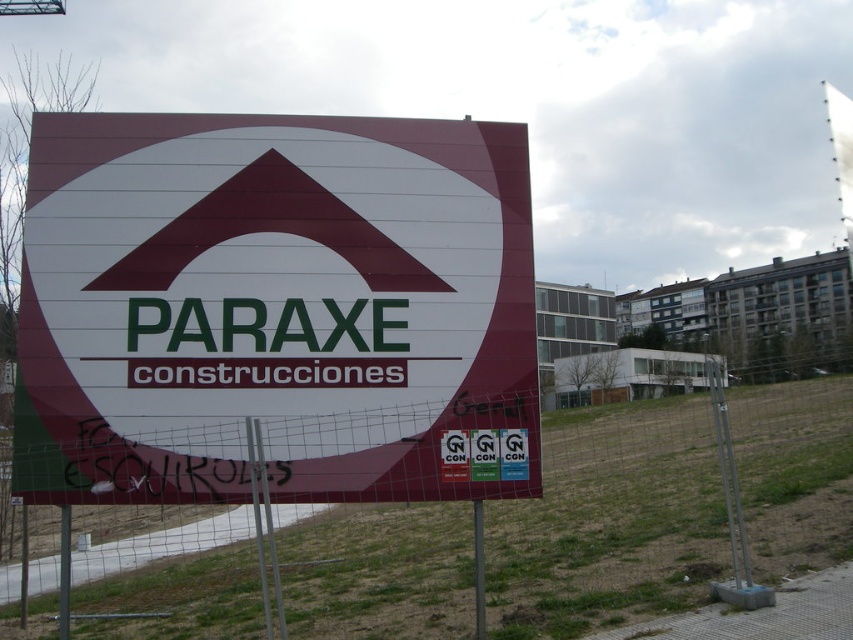
Between maroon plastic sign at center and metal mesh fence at center, which one appears on the right side from the viewer's perspective?

metal mesh fence at center

Is maroon plastic sign at center smaller than metal mesh fence at center?

Yes.

Where is `maroon plastic sign at center`? Image resolution: width=853 pixels, height=640 pixels. maroon plastic sign at center is located at coordinates (273, 305).

The width and height of the screenshot is (853, 640). Identify the location of maroon plastic sign at center. (273, 305).